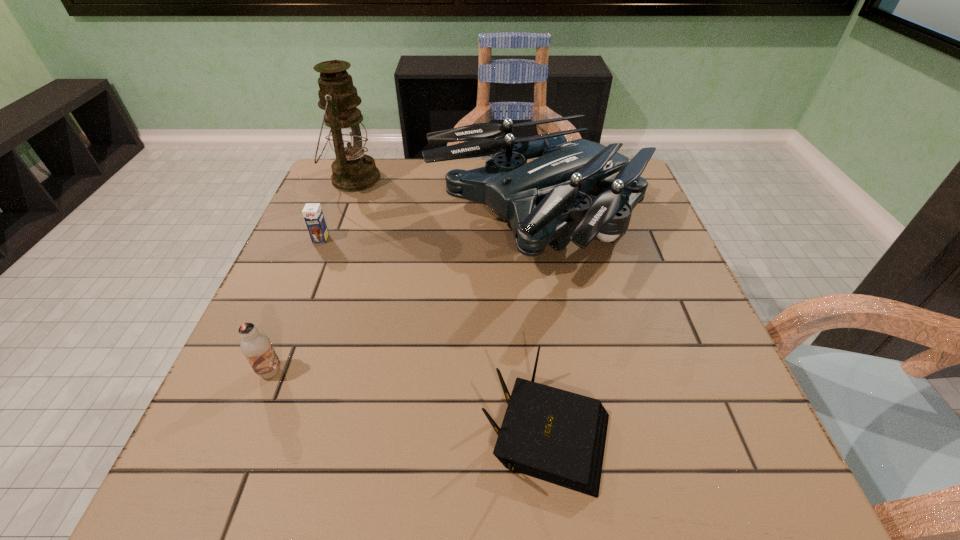
What are the coordinates of `vacant region at the right edge of the desktop` in the screenshot? It's located at (684, 437).

The width and height of the screenshot is (960, 540). What are the coordinates of `vacant space that is in between the second tallest object and the farther chocolate milk` in the screenshot? It's located at (429, 232).

At what (x,y) coordinates should I click in order to perform the action: click on vacant space that is in between the router and the oil lamp. Please return your answer as a coordinate pair (x, y). Looking at the image, I should click on (450, 304).

Image resolution: width=960 pixels, height=540 pixels. What are the coordinates of `free space between the nearer chocolate milk and the tallest object` in the screenshot? It's located at (312, 275).

The width and height of the screenshot is (960, 540). Find the location of `free point between the tallest object and the farther chocolate milk`. free point between the tallest object and the farther chocolate milk is located at coordinates (337, 209).

You are a GUI agent. You are given a task and a screenshot of the screen. Output one action in this format:
    pyautogui.click(x=<x>, y=<y>)
    Task: Click on the free space between the tallest object and the drone
    This screenshot has height=540, width=960.
    Given the screenshot: What is the action you would take?
    pyautogui.click(x=445, y=201)

Identify the location of empty space between the nearer chocolate milk and the oil lamp. (312, 275).

Identify the location of free area in between the oil lamp and the router. The image size is (960, 540). coord(450,304).

You are a GUI agent. You are given a task and a screenshot of the screen. Output one action in this format:
    pyautogui.click(x=<x>, y=<y>)
    Task: Click on the free point between the farther chocolate milk and the fourth shortest object
    The image size is (960, 540).
    Given the screenshot: What is the action you would take?
    click(429, 232)

At what (x,y) coordinates should I click in order to perform the action: click on unoccupied area between the oil lamp and the fourth shortest object. Please return your answer as a coordinate pair (x, y). Image resolution: width=960 pixels, height=540 pixels. Looking at the image, I should click on (445, 201).